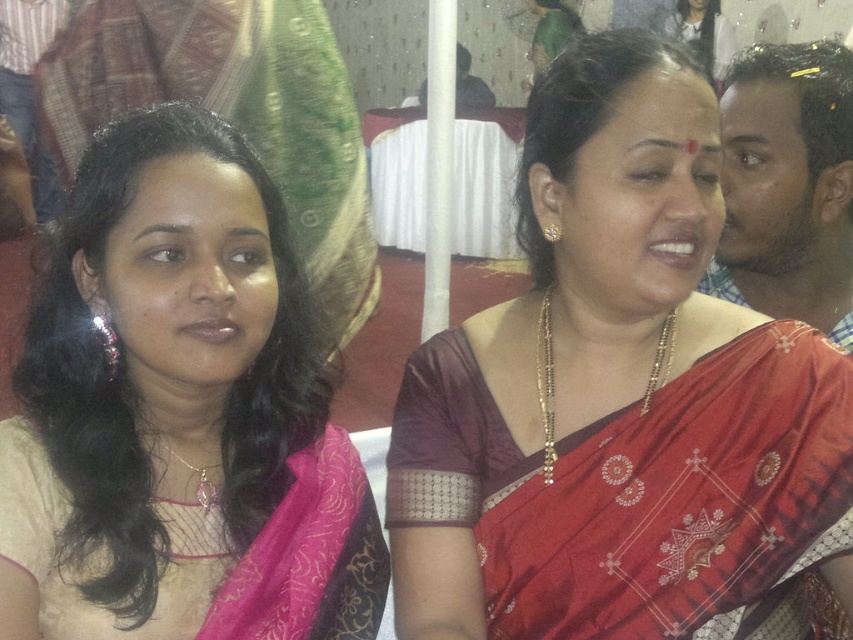
Question: Which point is farther from the camera taking this photo?

Choices:
 (A) (180, 598)
 (B) (527, 444)

Answer: (B)

Question: Does matte gold necklace at upper center appear over pink silk saree at left?

Choices:
 (A) no
 (B) yes

Answer: (B)

Question: Can you confirm if matte gold necklace at upper center is positioned to the right of pink silk saree at left?

Choices:
 (A) no
 (B) yes

Answer: (B)

Question: Does matte gold necklace at upper center appear under pink silk saree at left?

Choices:
 (A) no
 (B) yes

Answer: (A)